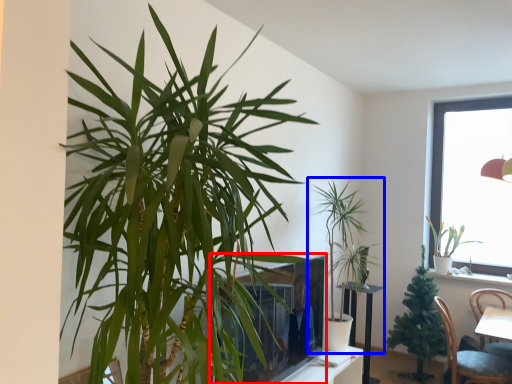
Question: Which of the following is the farthest to the observer, window screen (highlighted by a red box) or houseplant (highlighted by a blue box)?

Choices:
 (A) window screen
 (B) houseplant

Answer: (B)